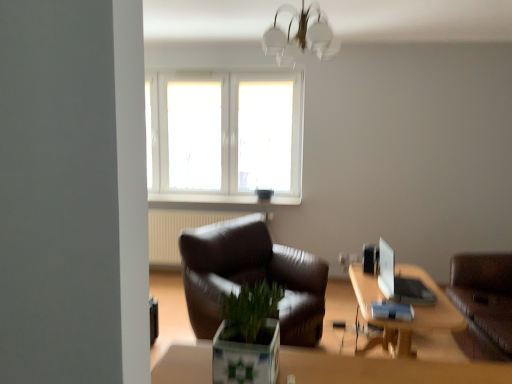
At what (x,y) coordinates should I click in order to perform the action: click on white plastic window at upper center. Please return your answer as a coordinate pair (x, y). Looking at the image, I should click on (225, 134).

This screenshot has height=384, width=512. I want to click on wooden table at lower right, so click(413, 309).

This screenshot has height=384, width=512. Describe the element at coordinates (413, 309) in the screenshot. I see `wooden table at lower right` at that location.

The width and height of the screenshot is (512, 384). I want to click on white frosted glass chandelier at upper center, so click(x=301, y=37).

In order to face green matte plant at center, should I rotate leftwards or rightwards?

Rotate your view left by about 0.079°.

Describe the element at coordinates (400, 282) in the screenshot. I see `white glossy monitor at upper right` at that location.

Find the location of a particular element. The height and width of the screenshot is (384, 512). white plastic window at upper center is located at coordinates (225, 134).

How different are the orientations of white glossy monitor at upper right and green matte plant at center in degrees?

They differ by 88 degrees in their facing directions.

Choose the correct answer: Is white glossy monitor at upper right inside green matte plant at center or outside it?

white glossy monitor at upper right lies outside green matte plant at center.

From a real-world perspective, which is physically above, white glossy monitor at upper right or green matte plant at center?

green matte plant at center, from a real-world perspective.

Who is taller, white glossy monitor at upper right or green matte plant at center?

Standing taller between the two is white glossy monitor at upper right.

Does point (477, 261) appear closer or farther from the camera than point (268, 309)?

Point (477, 261).

Considering their positions, is brown leather couch at right located in front of or behind green matte plant at center?

brown leather couch at right is behind green matte plant at center.

Do you think green matte plant at center is within wooden table at lower right, or outside of it?

green matte plant at center is located beyond the bounds of wooden table at lower right.

Between green matte plant at center and wooden table at lower right, which one is positioned behind?

Positioned behind is wooden table at lower right.

Image resolution: width=512 pixels, height=384 pixels. Identify the location of plant that is above the wooden table at lower right (from the image's perspective). (250, 310).

Is white glossy monitor at upper right facing towards white frosted glass chandelier at upper center?

No, white glossy monitor at upper right is not oriented towards white frosted glass chandelier at upper center.

How many degrees apart are the facing directions of white glossy monitor at upper right and white frosted glass chandelier at upper center?

6.64e-05 degrees separate the facing orientations of white glossy monitor at upper right and white frosted glass chandelier at upper center.

From the picture: Who is shorter, white glossy monitor at upper right or white frosted glass chandelier at upper center?

With less height is white glossy monitor at upper right.

From a real-world perspective, is white glossy monitor at upper right over white frosted glass chandelier at upper center?

No, from a real-world perspective, white glossy monitor at upper right is not above white frosted glass chandelier at upper center.

Which is behind, point (396, 287) or point (509, 263)?

The point (509, 263) is farther.

Is brown leather couch at right surrounded by white glossy monitor at upper right?

No, brown leather couch at right is located outside of white glossy monitor at upper right.

From a real-world perspective, which object stands above the other?

From a 3D spatial view, white glossy monitor at upper right is above.

Is white glossy monitor at upper right to the left or to the right of brown leather couch at right in the image?

In the image, white glossy monitor at upper right appears on the left side of brown leather couch at right.

Is brown leather couch at right positioned with its back to white frosted glass chandelier at upper center?

No, brown leather couch at right's orientation is not away from white frosted glass chandelier at upper center.

Is brown leather couch at right inside or outside of white frosted glass chandelier at upper center?

brown leather couch at right is spatially situated outside white frosted glass chandelier at upper center.

From the image's perspective, is brown leather couch at right on white frosted glass chandelier at upper center?

No, from the image's perspective, brown leather couch at right is not over white frosted glass chandelier at upper center.

Between point (471, 321) and point (325, 38), which one is positioned behind?

Point (325, 38)

Can you confirm if white frosted glass chandelier at upper center is positioned to the left of white glossy monitor at upper right?

Yes.

Consider the image. Considering the positions of objects white frosted glass chandelier at upper center and white glossy monitor at upper right in the image provided, who is in front, white frosted glass chandelier at upper center or white glossy monitor at upper right?

white frosted glass chandelier at upper center is in front.

Is white frosted glass chandelier at upper center taller or shorter than white glossy monitor at upper right?

In the image, white frosted glass chandelier at upper center appears to be taller than white glossy monitor at upper right.

This screenshot has width=512, height=384. I want to click on computer below the green matte plant at center (from the image's perspective), so click(400, 282).

Where is `studio couch behind the green matte plant at center`? The image size is (512, 384). studio couch behind the green matte plant at center is located at coordinates (484, 295).

Based on their spatial positions, is wooden table at lower right or white plastic window at upper center closer to green matte plant at center?

wooden table at lower right lies closer to green matte plant at center than the other object.

Considering their positions, is white glossy monitor at upper right positioned further to brown leather couch at right than wooden table at lower right?

white glossy monitor at upper right is further to brown leather couch at right.

In the scene shown: Looking at the image, which one is located further to white frosted glass chandelier at upper center, brown leather couch at right or white glossy monitor at upper right?

The object further to white frosted glass chandelier at upper center is brown leather couch at right.

When comparing their distances from wooden table at lower right, does white glossy monitor at upper right or white plastic window at upper center seem further?

white plastic window at upper center.

From the image, which object appears to be nearer to green matte plant at center, brown leather couch at right or white glossy monitor at upper right?

Based on the image, white glossy monitor at upper right appears to be nearer to green matte plant at center.

Estimate the real-world distances between objects in this image. Which object is closer to white frosted glass chandelier at upper center, green matte plant at center or white plastic window at upper center?

white plastic window at upper center lies closer to white frosted glass chandelier at upper center than the other object.

Based on the photo, when comparing their distances from brown leather couch at right, does wooden table at lower right or white plastic window at upper center seem closer?

Among the two, wooden table at lower right is located nearer to brown leather couch at right.

Considering their positions, is wooden table at lower right positioned closer to white frosted glass chandelier at upper center than green matte plant at center?

Among the two, wooden table at lower right is located nearer to white frosted glass chandelier at upper center.

You are a GUI agent. You are given a task and a screenshot of the screen. Output one action in this format:
    pyautogui.click(x=<x>, y=<y>)
    Task: Click on the computer between white frosted glass chandelier at upper center and white plastic window at upper center in the front-back direction
    This screenshot has width=512, height=384.
    Given the screenshot: What is the action you would take?
    pyautogui.click(x=400, y=282)

Locate an element on the screen. This screenshot has width=512, height=384. computer positioned between brown leather couch at right and white plastic window at upper center from near to far is located at coordinates (400, 282).

What are the coordinates of `computer between green matte plant at center and white plastic window at upper center along the z-axis` in the screenshot? It's located at (400, 282).

This screenshot has width=512, height=384. Find the location of `lamp between green matte plant at center and white glossy monitor at upper right in the front-back direction`. lamp between green matte plant at center and white glossy monitor at upper right in the front-back direction is located at coordinates (301, 37).